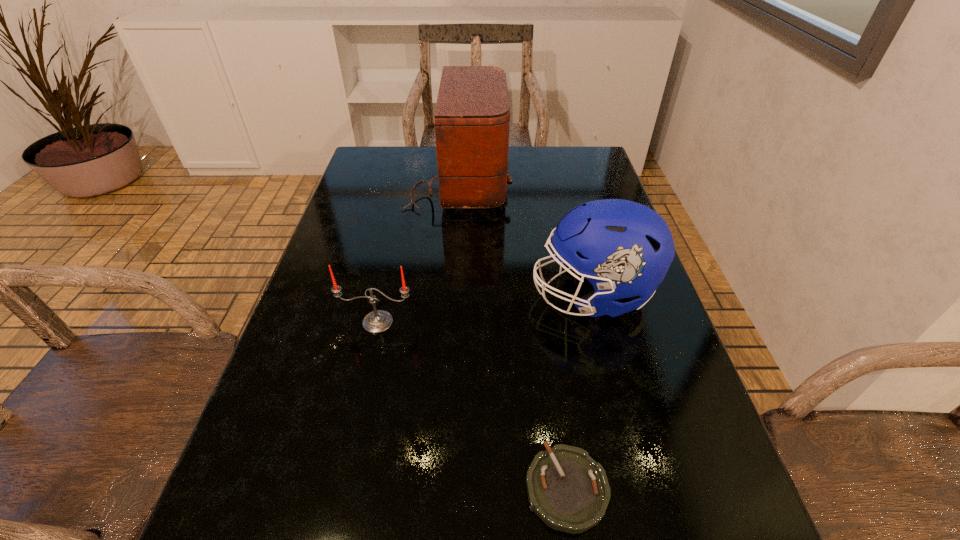
Image resolution: width=960 pixels, height=540 pixels. I want to click on free space that satisfies the following two spatial constraints: 1. on the front-facing side of the candle; 2. on the left side of the shortest object, so click(x=341, y=488).